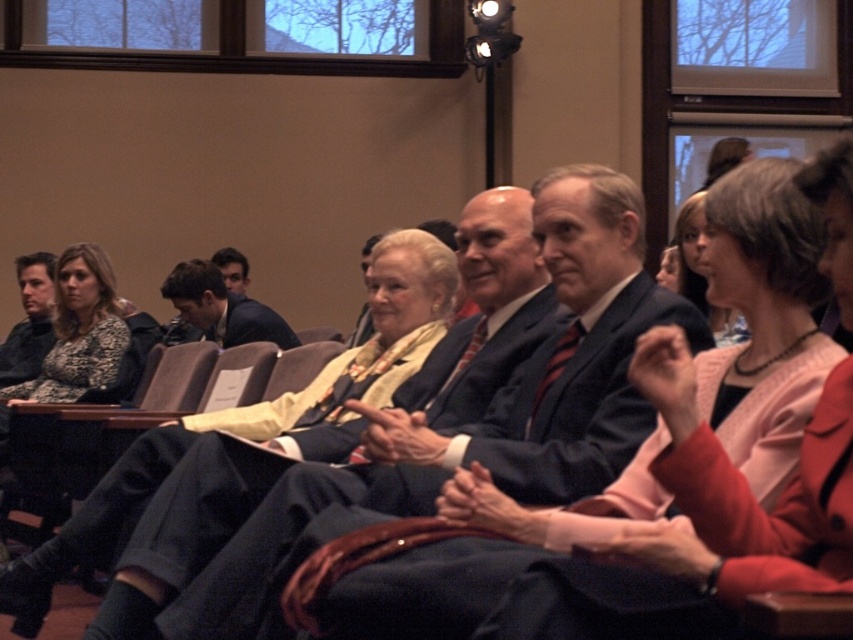
You are an event planner organizing a VIP seating arrangement. You need to place two important guests wearing the matte black suit at center and dark blue suit at center so that they are exactly 5 meters apart. Based on the current setup, will their current positions meet this requirement?

The distance between the matte black suit at center and dark blue suit at center is currently 5.35 meters, which is slightly more than the required 5 meters. Therefore, their current positions do not meet the exact requirement of being exactly 5 meters apart.

You are an event organizer who needs to arrange seating for a panel discussion. You have two chairs available, one slightly wider than the other. The wider chair can only accommodate individuals wearing wider suits. Given the attendees in the scene, which attendee in the matte black suit at center or the dark blue suit at center would you seat in the wider chair?

The matte black suit at center has a greater width than the dark blue suit at center, so the attendee wearing the matte black suit at center should be seated in the wider chair to ensure comfort and proper fit.

You are an event planner trying to arrange seating for a panel discussion. You need to place a name tag on the table in front of the matte black suit at center and dark blue suit at center. Based on their positions in the image, which name tag should be placed closer to the front of the table?

The matte black suit at center is located below the dark blue suit at center, meaning it is closer to the front of the table. Therefore, the name tag for the matte black suit at center should be placed closer to the front of the table.